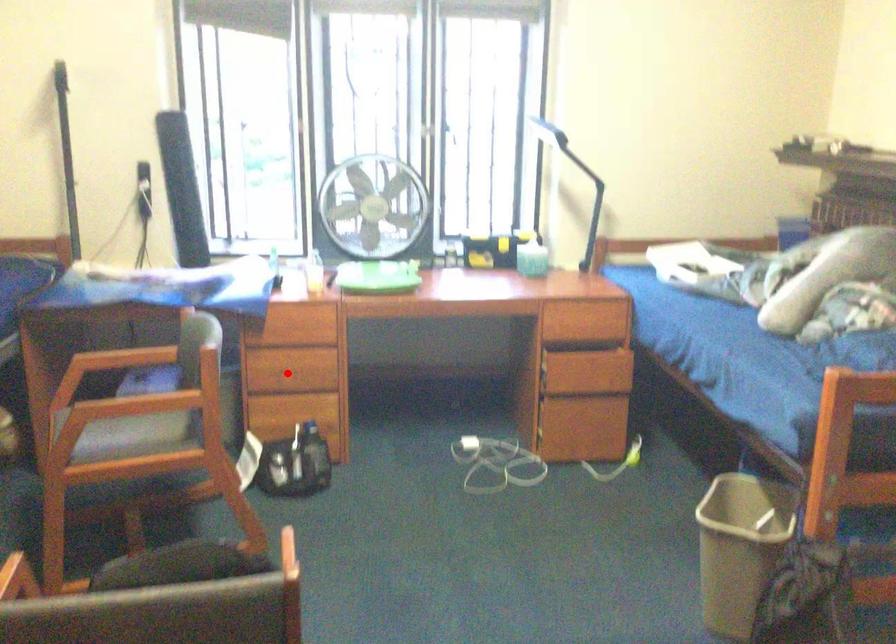
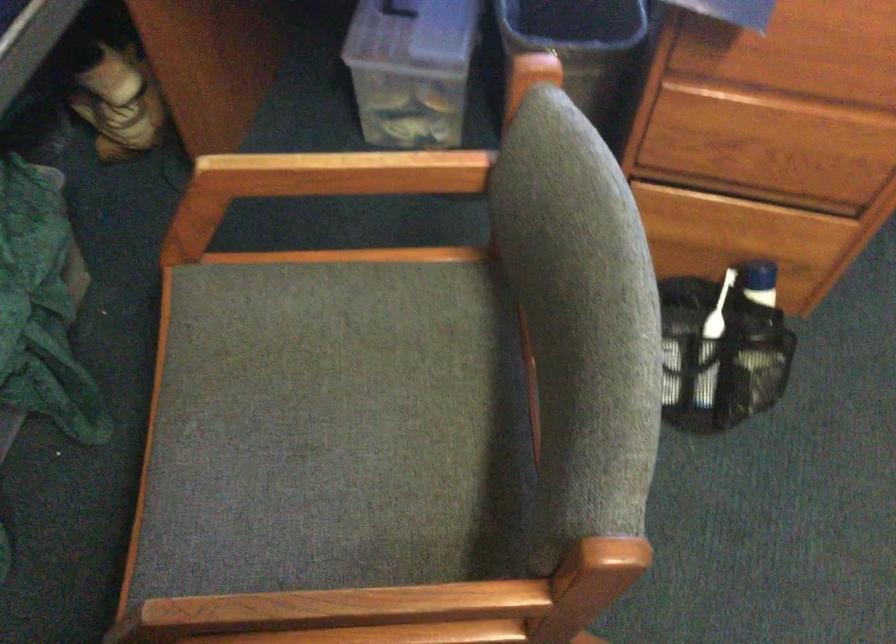
Question: I am providing you with two images of the same scene from different viewpoints. A red point is shown in image1. For the corresponding object point in image2, is it positioned nearer or farther from the camera?

Choices:
 (A) Nearer
 (B) Farther

Answer: (A)